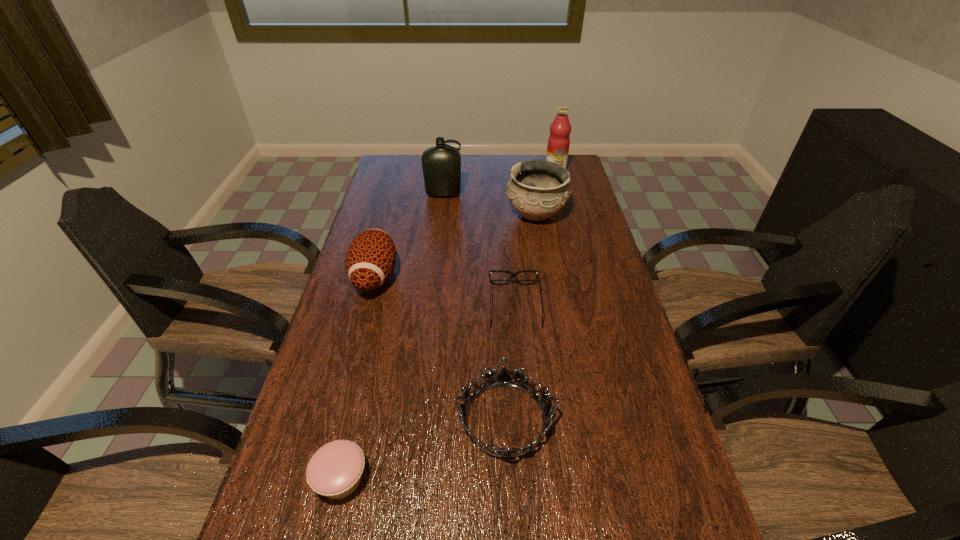
Where is `the farthest object`? Image resolution: width=960 pixels, height=540 pixels. the farthest object is located at coordinates point(559,141).

I want to click on bottle, so click(441, 164).

The image size is (960, 540). Identify the location of pottery. (537, 189).

This screenshot has height=540, width=960. I want to click on the fourth tallest object, so click(x=371, y=257).

Where is `tiara`? tiara is located at coordinates (503, 379).

The height and width of the screenshot is (540, 960). Identify the location of cupcake. (335, 470).

You are a GUI agent. You are given a task and a screenshot of the screen. Output one action in this format:
    pyautogui.click(x=<x>, y=<y>)
    Task: Click on the spectacles
    The image size is (960, 540).
    Given the screenshot: What is the action you would take?
    pyautogui.click(x=514, y=275)

What are the coordinates of `free point located on the label of the fruit juice` in the screenshot? It's located at (565, 207).

Locate an element on the screen. vacant region located 0.170m on the front of the bottle is located at coordinates (440, 227).

Identify the location of vacant space situated on the left of the third tallest object. (444, 214).